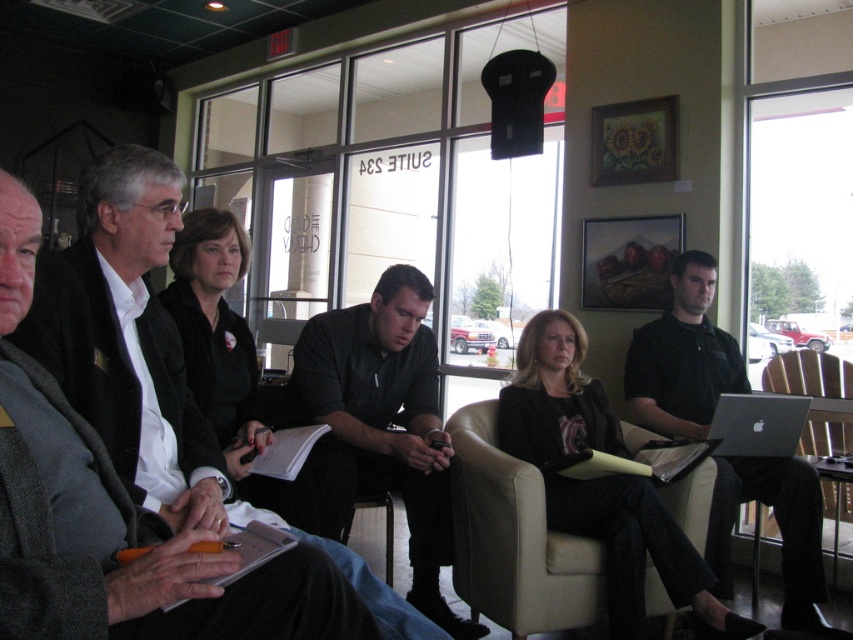
What do you see at coordinates (514, 538) in the screenshot?
I see `beige leather armchair at center` at bounding box center [514, 538].

Is point (466, 524) positioned behind point (350, 520)?

That is False.

Between point (521, 572) and point (293, 422), which one is positioned in front?

Point (521, 572) is more forward.

Identify the location of beige leather armchair at center. Image resolution: width=853 pixels, height=640 pixels. (514, 538).

Which is below, matte black jacket at center or brown leather armchair at center?

brown leather armchair at center

Between point (169, 436) and point (840, 362), which one is positioned behind?

Point (840, 362)

Where is `matte black jacket at center`? matte black jacket at center is located at coordinates (134, 346).

Based on the photo, can you confirm if matte black jacket at center is wider than beige leather armchair at center?

In fact, matte black jacket at center might be narrower than beige leather armchair at center.

Between point (154, 358) and point (489, 435), which one is positioned in front?

Positioned in front is point (154, 358).

You are a GUI agent. You are given a task and a screenshot of the screen. Output one action in this format:
    pyautogui.click(x=<x>, y=<y>)
    Task: Click on the matte black jacket at center
    This screenshot has width=853, height=640.
    Given the screenshot: What is the action you would take?
    pyautogui.click(x=134, y=346)